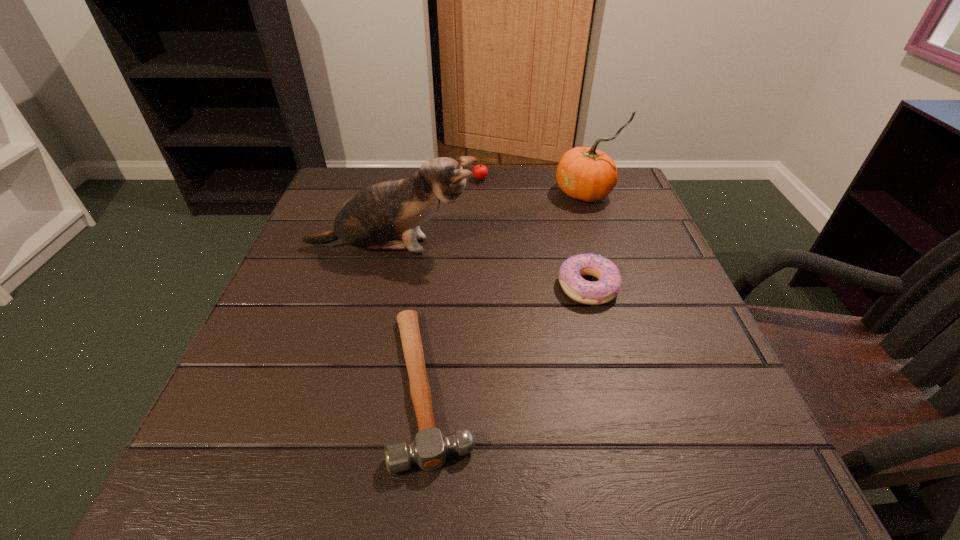
This screenshot has height=540, width=960. In order to click on blank space at the near edge of the desktop in this screenshot , I will do tap(598, 487).

The height and width of the screenshot is (540, 960). In the image, there is a desktop. What are the coordinates of `vacant space at the right edge` in the screenshot? It's located at (639, 248).

I want to click on free space at the far left corner, so click(x=343, y=180).

This screenshot has width=960, height=540. Identify the location of vacant space at the near left corner of the desktop. (297, 499).

Identify the location of vacant space at the far right corner of the desktop. This screenshot has width=960, height=540. (611, 195).

Where is `vacant area at the near right corner`? The image size is (960, 540). vacant area at the near right corner is located at coordinates (766, 456).

At what (x,y) coordinates should I click in order to perform the action: click on vacant point located between the pumpkin and the nearest object. Please return your answer as a coordinate pair (x, y). This screenshot has height=540, width=960. Looking at the image, I should click on (509, 289).

You are a GUI agent. You are given a task and a screenshot of the screen. Output one action in this format:
    pyautogui.click(x=<x>, y=<y>)
    Task: Click on the free area in between the doughnut and the pumpkin
    The width and height of the screenshot is (960, 540).
    Given the screenshot: What is the action you would take?
    pyautogui.click(x=588, y=240)

The height and width of the screenshot is (540, 960). Identify the location of free space between the cherry and the hammer. (456, 282).

Locate an element on the screen. free space that is in between the pumpkin and the cherry is located at coordinates (534, 186).